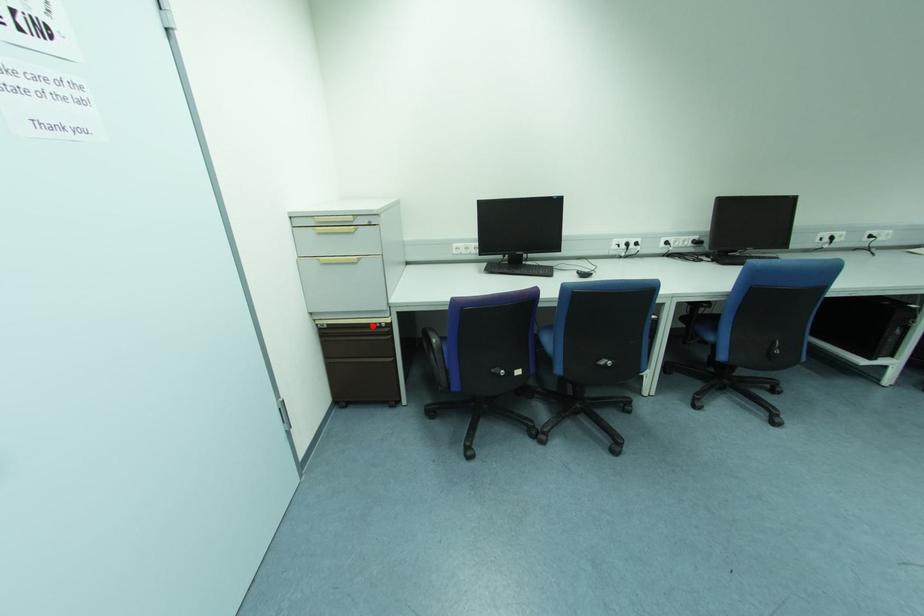
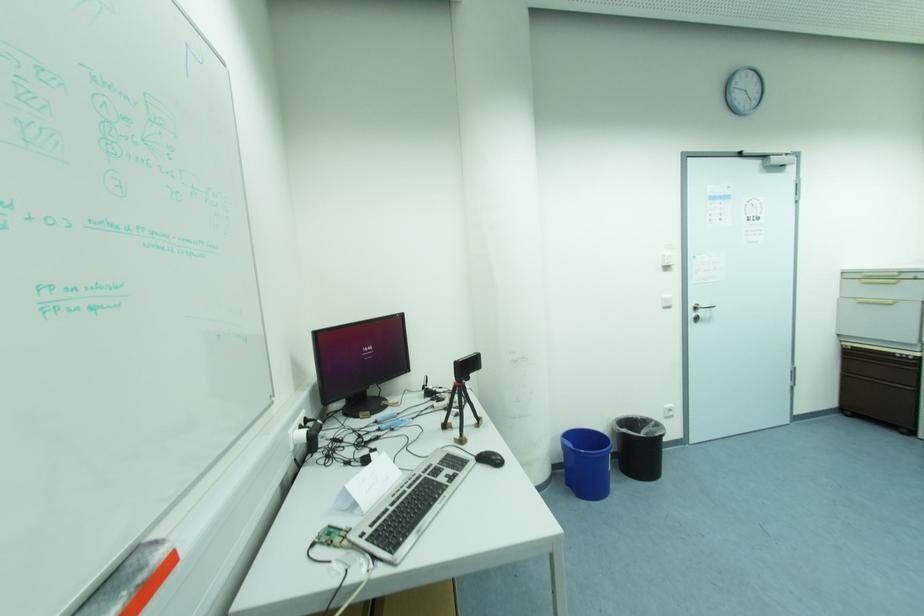
Locate, in the second image, the point that corresponds to the highlighted location in the first image.

(898, 355)